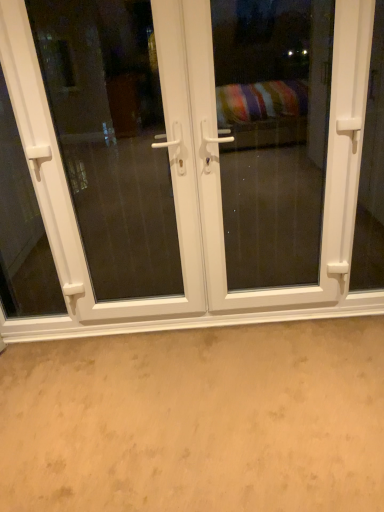
Find the location of a particular element. Image resolution: width=384 pixels, height=512 pixels. vacant space underneath white plastic screen door at center, acting as the first screen door starting from the left (from a real-world perspective) is located at coordinates (138, 324).